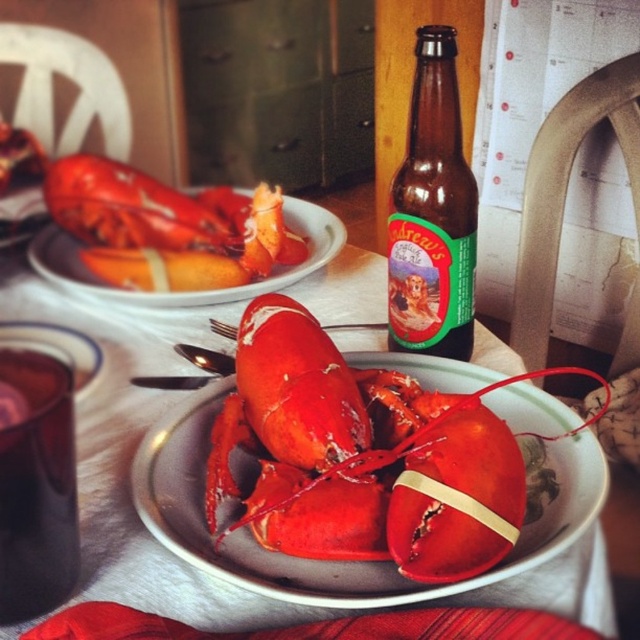
Looking at this image, is matte ceramic plate at center positioned in front of matte ceramic lobster at center?

Yes, it is in front of matte ceramic lobster at center.

Does point (26, 285) come farther from viewer compared to point (54, 225)?

No, (26, 285) is closer to viewer.

In order to click on matte ceramic plate at center in this screenshot , I will do `click(129, 488)`.

Who is positioned more to the right, shiny red lobster at center or matte ceramic plate at center?

Positioned to the right is shiny red lobster at center.

From the picture: Does shiny red lobster at center have a lesser height compared to matte ceramic plate at center?

Indeed, shiny red lobster at center has a lesser height compared to matte ceramic plate at center.

What do you see at coordinates (369, 456) in the screenshot? The height and width of the screenshot is (640, 640). I see `shiny red lobster at center` at bounding box center [369, 456].

Locate an element on the screen. shiny red lobster at center is located at coordinates (369, 456).

The height and width of the screenshot is (640, 640). What do you see at coordinates (129, 488) in the screenshot?
I see `matte ceramic plate at center` at bounding box center [129, 488].

Is matte ceramic plate at center above brown glass bottle at center?

Incorrect, matte ceramic plate at center is not positioned above brown glass bottle at center.

Locate an element on the screen. matte ceramic plate at center is located at coordinates (129, 488).